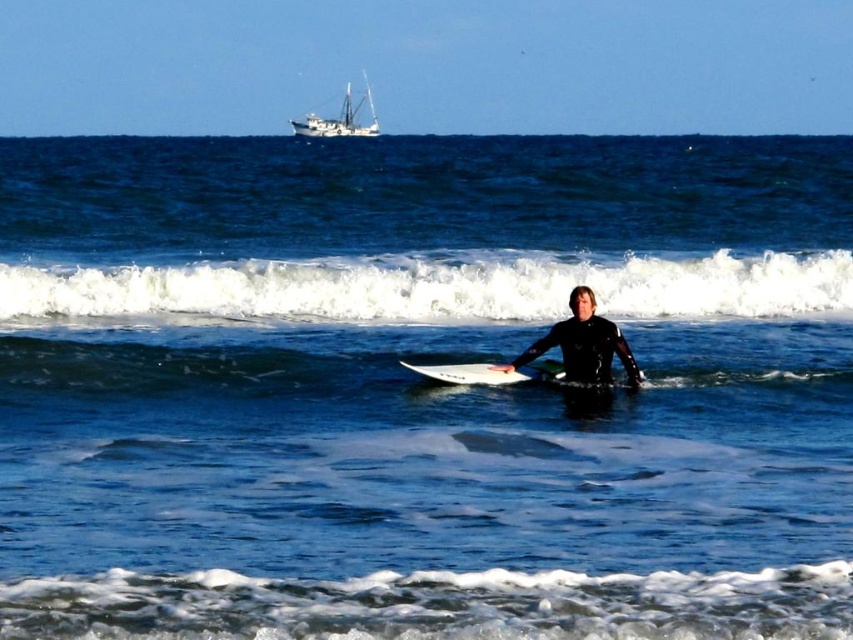
You are a surfer looking at the ocean scene. You see the white foamy wave at center and the white glossy surfboard at center. Which object is taller?

The white foamy wave at center is much taller than the white glossy surfboard at center.